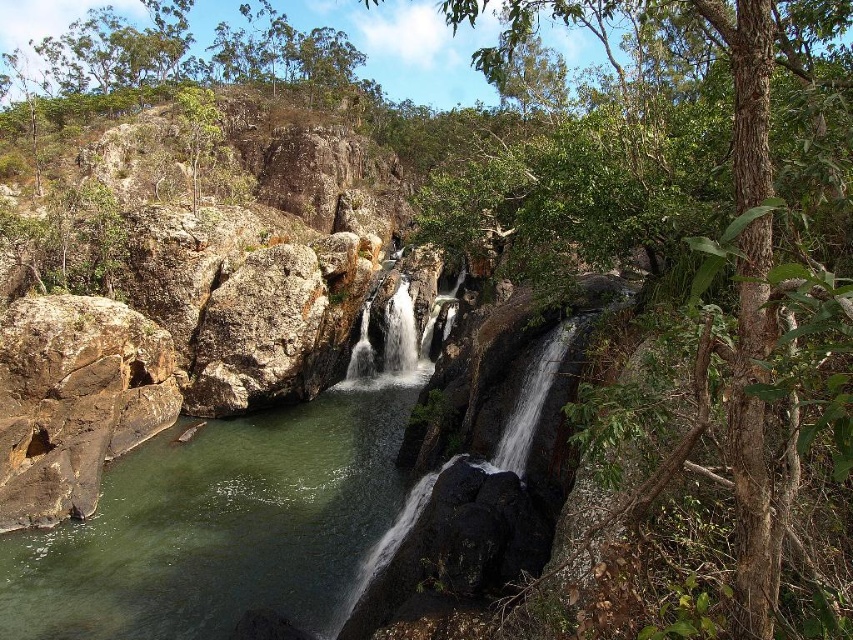
Find the location of a particular element. This screenshot has height=640, width=853. green smooth water at center left is located at coordinates (219, 525).

Between green smooth water at center left and brown rough rock at left, which one appears on the right side from the viewer's perspective?

green smooth water at center left is more to the right.

Is point (225, 440) positioned before point (54, 435)?

No, (225, 440) is behind (54, 435).

Find the location of `green smooth water at center left`. green smooth water at center left is located at coordinates (219, 525).

Can you confirm if rough textured rock at center is shorter than white smooth waterfall at center?

In fact, rough textured rock at center may be taller than white smooth waterfall at center.

Identify the location of rough textured rock at center. (258, 333).

Does point (300, 369) come farther from viewer compared to point (428, 362)?

No.

Identify the location of rough textured rock at center. The height and width of the screenshot is (640, 853). (258, 333).

Can you confirm if brown rough rock at left is bigger than rough textured rock at center?

Correct, brown rough rock at left is larger in size than rough textured rock at center.

Between brown rough rock at left and rough textured rock at center, which one appears on the left side from the viewer's perspective?

From the viewer's perspective, brown rough rock at left appears more on the left side.

Is point (83, 406) less distant than point (244, 339)?

Yes, point (83, 406) is in front of point (244, 339).

Where is `brown rough rock at left`? The width and height of the screenshot is (853, 640). brown rough rock at left is located at coordinates (74, 401).